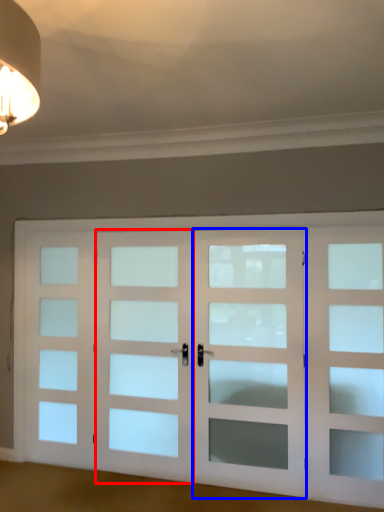
Question: Among these objects, which one is farthest to the camera, screen door (highlighted by a red box) or screen door (highlighted by a blue box)?

Choices:
 (A) screen door
 (B) screen door

Answer: (A)